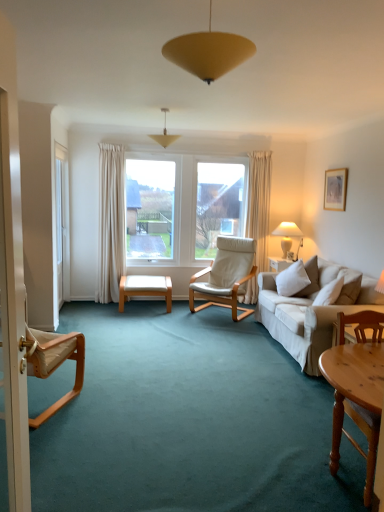
Locate an element on the screen. vacant space in front of light wood bench at center is located at coordinates (151, 317).